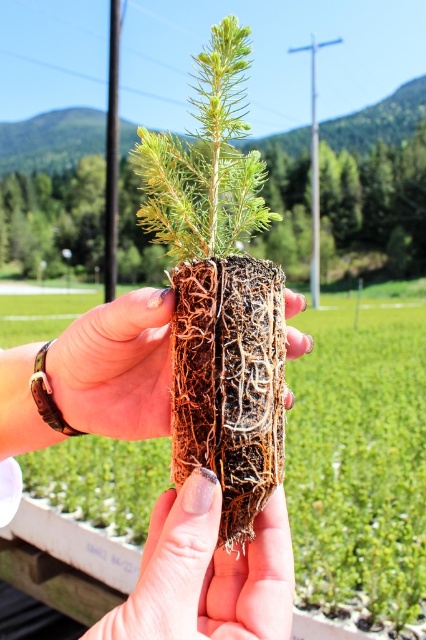
Is brown textured soil at center to the right of brown textured roots at center from the viewer's perspective?

Correct, you'll find brown textured soil at center to the right of brown textured roots at center.

Does brown textured soil at center have a larger size compared to brown textured roots at center?

Actually, brown textured soil at center might be smaller than brown textured roots at center.

Is point (155, 605) positioned in front of point (134, 422)?

Yes, point (155, 605) is closer to viewer.

This screenshot has height=640, width=426. In order to click on brown textured soil at center in this screenshot , I will do `click(207, 573)`.

Can you confirm if green fibrous root ball at center is wider than brown textured roots at center?

Indeed, green fibrous root ball at center has a greater width compared to brown textured roots at center.

Image resolution: width=426 pixels, height=640 pixels. Find the location of `green fibrous root ball at center`. green fibrous root ball at center is located at coordinates (52, 204).

Does green fibrous root ball at center lie in front of brown textured soil at center?

No, it is not.

Which is more to the left, green fibrous root ball at center or brown textured soil at center?

From the viewer's perspective, brown textured soil at center appears more on the left side.

You are a GUI agent. You are given a task and a screenshot of the screen. Output one action in this format:
    pyautogui.click(x=<x>, y=<y>)
    Task: Click on the green fibrous root ball at center
    The height and width of the screenshot is (640, 426).
    Given the screenshot: What is the action you would take?
    pyautogui.click(x=52, y=204)